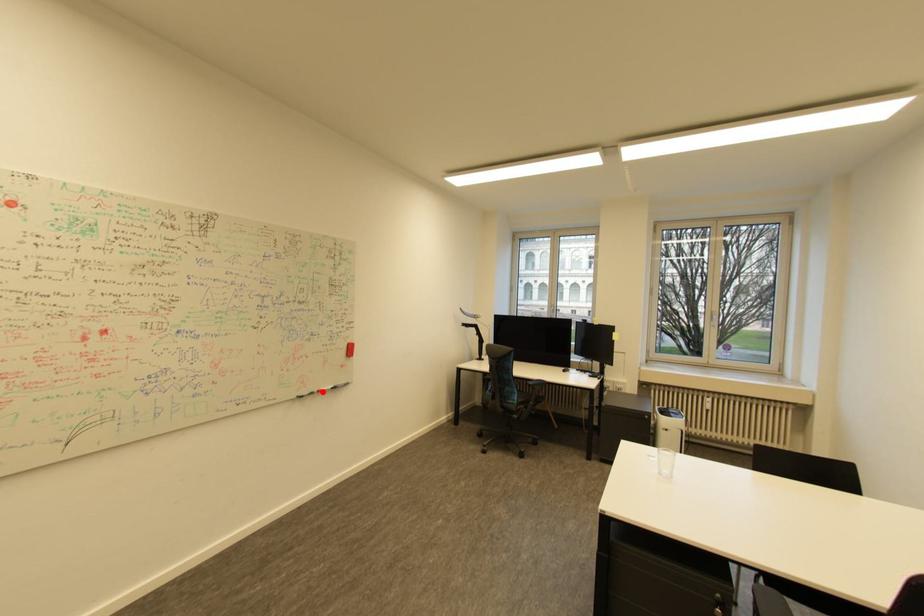
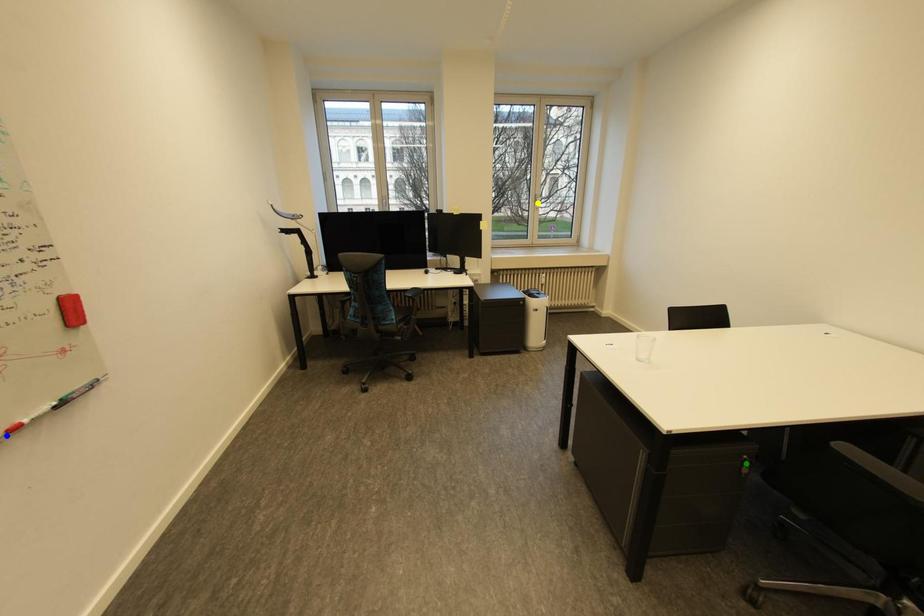
Question: I am providing you with two images of the same scene from different viewpoints. A red point is marked on the first image. You are given multiple points on the second image. Which spot in image 2 lines up with the point in image 1?

Choices:
 (A) blue point
 (B) yellow point
 (C) green point

Answer: (A)